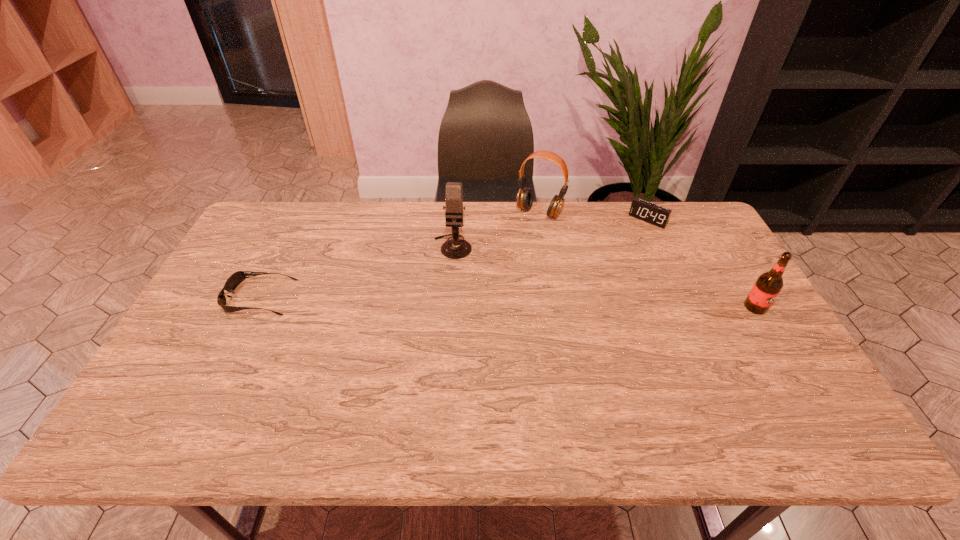
Locate an element on the screen. free space on the desktop that is between the leftmost object and the rightmost object and is positioned on the front-facing side of the third nearest object is located at coordinates (446, 301).

At what (x,y) coordinates should I click in order to perform the action: click on vacant spot on the desktop that is between the shortest object and the rightmost object and is positioned on the front-facing side of the second object from right to left. Please return your answer as a coordinate pair (x, y). The height and width of the screenshot is (540, 960). Looking at the image, I should click on (579, 303).

Locate an element on the screen. vacant spot on the desktop that is between the shortest object and the root beer and is positioned on the ear cups of the headset is located at coordinates (481, 302).